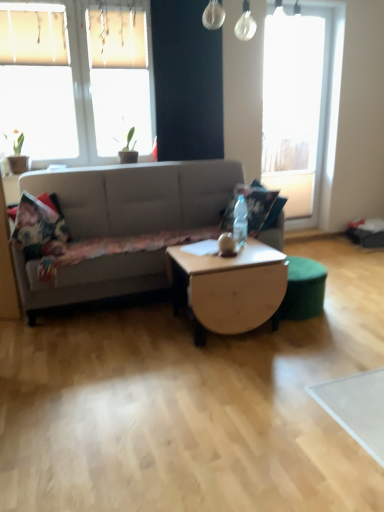
Question: From the image's perspective, would you say transparent glass window at upper right, which is the 1th window in back-to-front order, is shown under fluffy floral pillow at center, which ranks as the 1th pillow in right-to-left order?

Choices:
 (A) yes
 (B) no

Answer: (B)

Question: From a real-world perspective, is transparent glass window at upper right, which is the 1th window in back-to-front order, physically below fluffy floral pillow at center, the 2th pillow from the left?

Choices:
 (A) no
 (B) yes

Answer: (A)

Question: Is transparent glass window at upper right, positioned as the first window in right-to-left order, not inside fluffy floral pillow at center, which ranks as the 1th pillow in right-to-left order?

Choices:
 (A) yes
 (B) no

Answer: (A)

Question: Is transparent glass window at upper right, which is the 1th window in back-to-front order, not close to fluffy floral pillow at center, the 2th pillow from the left?

Choices:
 (A) yes
 (B) no

Answer: (A)

Question: From the image's perspective, is transparent glass window at upper right, which ranks as the second window in left-to-right order, on top of fluffy floral pillow at center, which ranks as the 1th pillow in right-to-left order?

Choices:
 (A) yes
 (B) no

Answer: (A)

Question: From a real-world perspective, relative to wooden coffee table at center, is transparent glass window at upper right, which is the second window from front to back, vertically above or below?

Choices:
 (A) below
 (B) above

Answer: (B)

Question: Would you say transparent glass window at upper right, positioned as the first window in right-to-left order, is to the left or to the right of wooden coffee table at center in the picture?

Choices:
 (A) left
 (B) right

Answer: (B)

Question: In terms of height, does transparent glass window at upper right, which is the second window from front to back, look taller or shorter compared to wooden coffee table at center?

Choices:
 (A) tall
 (B) short

Answer: (A)

Question: Which is correct: transparent glass window at upper right, positioned as the first window in right-to-left order, is inside wooden coffee table at center, or outside of it?

Choices:
 (A) outside
 (B) inside

Answer: (A)

Question: Is fluffy floral pillow at left, the 2th pillow from the right, wider or thinner than matte gray studio couch at center?

Choices:
 (A) wide
 (B) thin

Answer: (B)

Question: Looking at the image, does fluffy floral pillow at left, the 2th pillow from the right, seem bigger or smaller compared to matte gray studio couch at center?

Choices:
 (A) small
 (B) big

Answer: (A)

Question: Does point (38, 199) appear closer or farther from the camera than point (241, 177)?

Choices:
 (A) closer
 (B) farther

Answer: (A)

Question: Is fluffy floral pillow at left, the 2th pillow from the right, inside the boundaries of matte gray studio couch at center, or outside?

Choices:
 (A) outside
 (B) inside

Answer: (B)

Question: From a real-world perspective, is wooden coffee table at center physically located above or below fluffy floral pillow at center, the 2th pillow from the left?

Choices:
 (A) above
 (B) below

Answer: (B)

Question: Is wooden coffee table at center spatially inside fluffy floral pillow at center, which ranks as the 1th pillow in right-to-left order, or outside of it?

Choices:
 (A) outside
 (B) inside

Answer: (A)